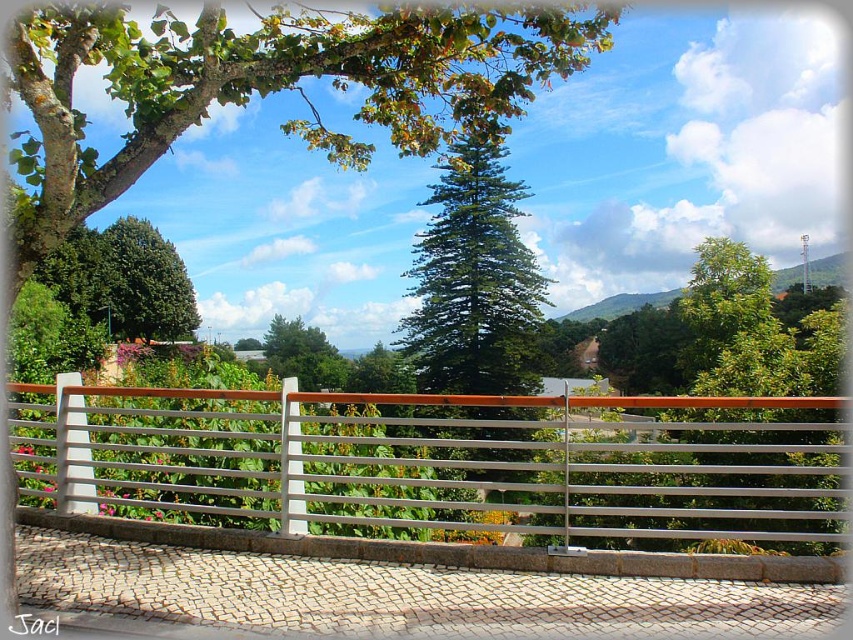
Does green leafy tree at upper center appear under green leafy tree at center?

No.

Can you confirm if green leafy tree at upper center is bigger than green leafy tree at center?

Indeed, green leafy tree at upper center has a larger size compared to green leafy tree at center.

Where is `green leafy tree at upper center`? green leafy tree at upper center is located at coordinates [265, 88].

Does silver metallic fence at center lie in front of green textured pine tree at center?

Yes, it is.

Based on the photo, between silver metallic fence at center and green textured pine tree at center, which one is positioned higher?

green textured pine tree at center

Between point (334, 522) and point (426, 268), which one is positioned behind?

Point (426, 268)

Image resolution: width=853 pixels, height=640 pixels. I want to click on silver metallic fence at center, so click(444, 461).

Looking at this image, measure the distance between point (x=436, y=333) and camera.

131.05 feet

Does green textured pine tree at center appear over green leafy tree at center?

Incorrect, green textured pine tree at center is not positioned above green leafy tree at center.

What do you see at coordinates (474, 280) in the screenshot? I see `green textured pine tree at center` at bounding box center [474, 280].

You are a GUI agent. You are given a task and a screenshot of the screen. Output one action in this format:
    pyautogui.click(x=<x>, y=<y>)
    Task: Click on the green textured pine tree at center
    
    Given the screenshot: What is the action you would take?
    pyautogui.click(x=474, y=280)